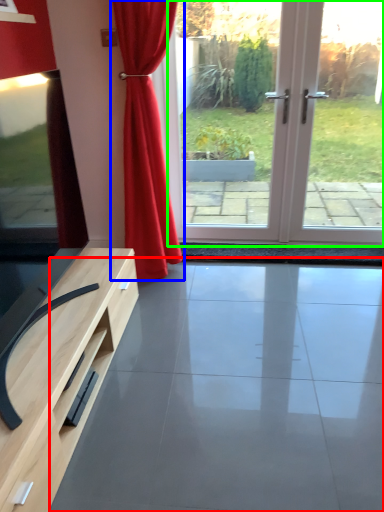
Question: Based on their relative distances, which object is nearer to concrete (highlighted by a red box)? Choose from curtain (highlighted by a blue box) and screen door (highlighted by a green box).

Choices:
 (A) curtain
 (B) screen door

Answer: (A)